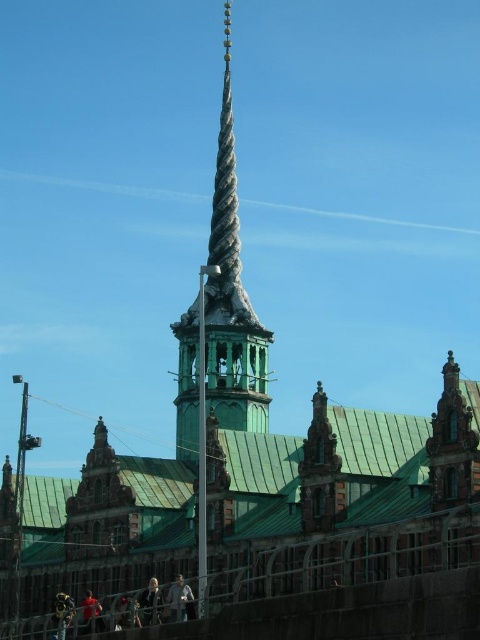
You are an architect examining the building with a green copper roof at center and a green wooden spire at center. From the perspective of someone standing in front of the building, which object is located to the left?

The green wooden spire at center is located to the left of the green copper roof at center.

You are an architect analyzing the building in the image. You need to determine which object is taller between the green copper roof at center and the green wooden spire at center. Based on the scene, which one is taller?

The green wooden spire at center is taller than the green copper roof at center.